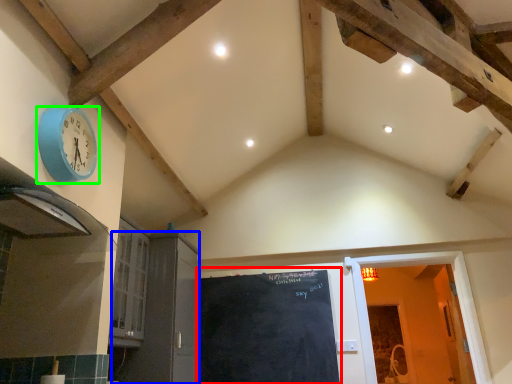
Question: Based on their relative distances, which object is nearer to bulletin board (highlighted by a red box)? Choose from door (highlighted by a blue box) and wall clock (highlighted by a green box).

Choices:
 (A) door
 (B) wall clock

Answer: (A)